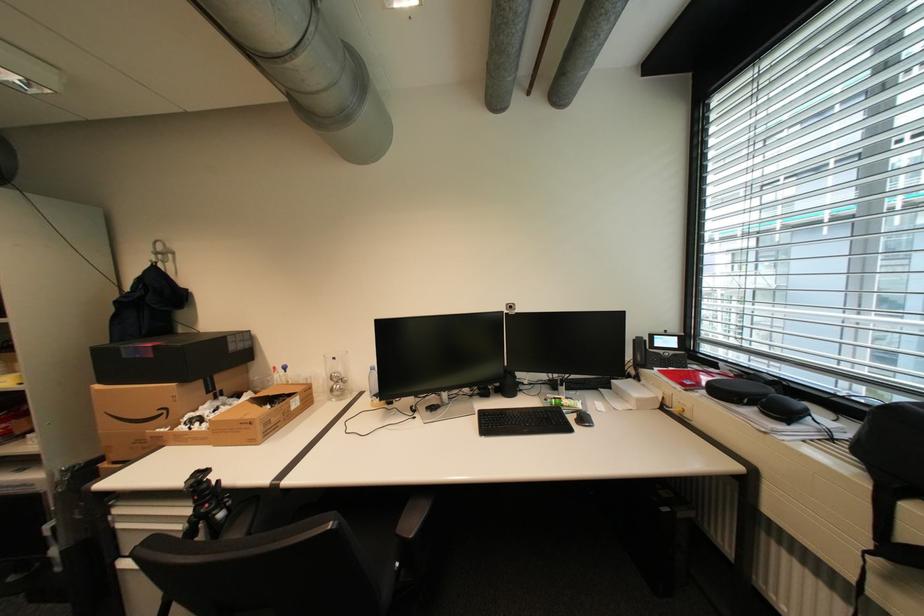
The location [171,358] corresponds to which object?

It refers to a black product box.